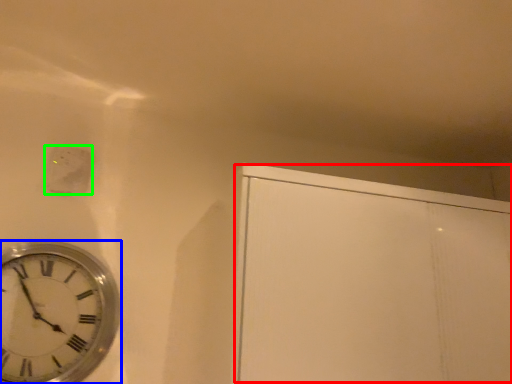
Question: Considering the real-world distances, which object is closest to glass door (highlighted by a red box)? wall clock (highlighted by a blue box) or electric outlet (highlighted by a green box).

Choices:
 (A) wall clock
 (B) electric outlet

Answer: (A)